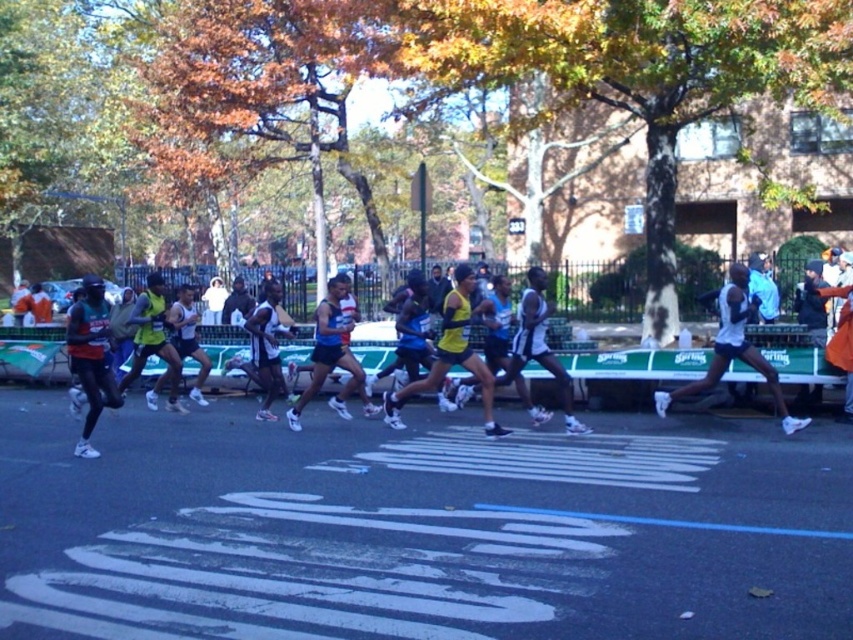
You are a photographer positioned at the starting line of the marathon. You want to capture a photo of the blue fabric shorts at center without the matte black running shoe at left overlapping it. Based on their widths, can you position yourself in a way to avoid the overlap?

The matte black running shoe at left might be wider than blue fabric shorts at center, so there is a possibility of overlap. To avoid this, position yourself slightly to the right side to ensure the blue fabric shorts at center is framed away from the matte black running shoe at left.

You are a photographer at the marathon event. You want to capture a photo where both the white matte running shoe at right and the yellow matte shorts at center are visible. Based on their sizes, which object should you ensure is closer to the camera to avoid being cut off?

The white matte running shoe at right is shorter than the yellow matte shorts at center, so to ensure both are visible, the white matte running shoe at right should be closer to the camera since it is smaller and might be more easily missed if farther away.

You are a photographer positioned at the starting line of the marathon. You want to capture a photo that includes both the matte black running shoe at left and the matte yellow tank top at center. What is the minimum distance you need to move backward to ensure both objects are in frame?

The minimum distance to move backward is 5.32 feet to include both the matte black running shoe at left and the matte yellow tank top at center in the photo.